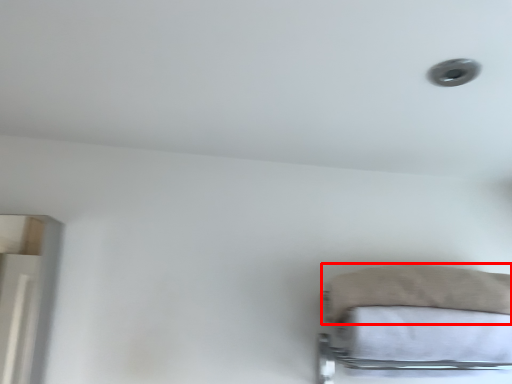
Question: In this image, where is pillow (annotated by the red box) located relative to sheet?

Choices:
 (A) left
 (B) right

Answer: (A)